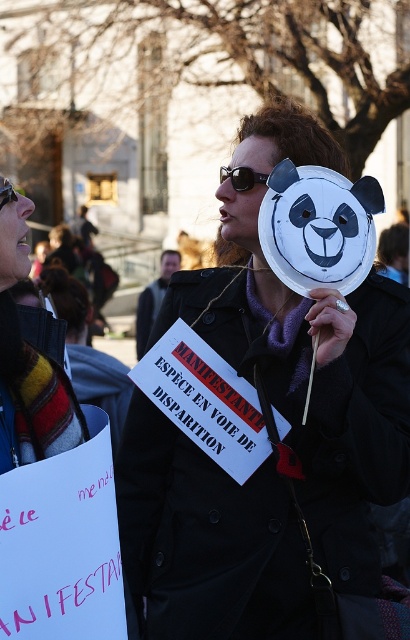
Question: Is striped wool scarf at upper left thinner than smooth skin face at center?

Choices:
 (A) no
 (B) yes

Answer: (A)

Question: Which point is farther to the camera?

Choices:
 (A) dark gray jacket at center
 (B) black plastic sunglasses at center
 (C) black plastic goggles at upper left
 (D) matte black sunglasses at upper center

Answer: (A)

Question: Which object appears closest to the camera in this image?

Choices:
 (A) matte black coat at center
 (B) dark gray jacket at center

Answer: (A)

Question: Can you confirm if dark gray jacket at center is positioned below smooth skin face at center?

Choices:
 (A) yes
 (B) no

Answer: (A)

Question: Is matte black sunglasses at upper center positioned behind dark gray jacket at center?

Choices:
 (A) no
 (B) yes

Answer: (A)

Question: Which object appears farthest from the camera in this image?

Choices:
 (A) dark gray jacket at center
 (B) black plastic sunglasses at center
 (C) matte black sunglasses at upper left

Answer: (A)